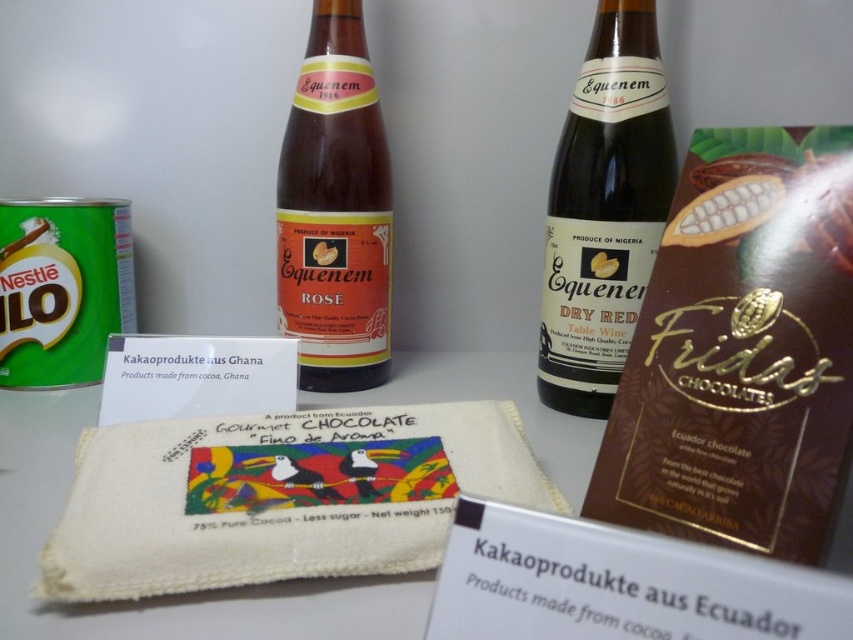
Question: Is brown glass bottle at center further to camera compared to matte glass bottle at center?

Choices:
 (A) yes
 (B) no

Answer: (B)

Question: Can you confirm if brown glass bottle at center is bigger than matte glass bottle at center?

Choices:
 (A) yes
 (B) no

Answer: (A)

Question: Which of the following is the closest to the observer?

Choices:
 (A) (618, 236)
 (B) (345, 13)

Answer: (A)

Question: Which object is farther from the camera taking this photo?

Choices:
 (A) brown glass bottle at center
 (B) matte glass bottle at center

Answer: (B)

Question: Which point appears farthest from the camera in this image?

Choices:
 (A) 627,179
 (B) 331,376

Answer: (B)

Question: Does brown glass bottle at center appear under matte glass bottle at center?

Choices:
 (A) yes
 (B) no

Answer: (A)